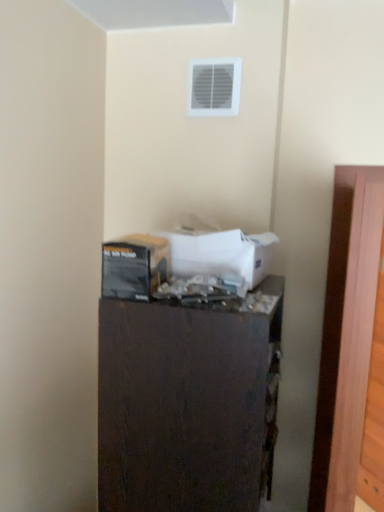
Find the location of a particular element. The height and width of the screenshot is (512, 384). white plastic vent at upper center is located at coordinates (213, 87).

At what (x,y) coordinates should I click in order to perform the action: click on wooden at right. Please return your answer as a coordinate pair (x, y). This screenshot has height=512, width=384. Looking at the image, I should click on (346, 335).

How much space does white cardboard box at center, which is counted as the first box, starting from the right, occupy vertically?

white cardboard box at center, which is counted as the first box, starting from the right, is 4.73 inches tall.

Measure the distance between dark wood dresser at center and camera.

A distance of 30.00 inches exists between dark wood dresser at center and camera.

The image size is (384, 512). I want to click on dark wood dresser at center, so click(188, 403).

Find the location of a particular element. This screenshot has height=512, width=384. white plastic vent at upper center is located at coordinates (213, 87).

Can white plastic vent at upper center be found inside dark wood dresser at center?

No, white plastic vent at upper center is not inside dark wood dresser at center.

Considering the positions of objects dark wood dresser at center and white plastic vent at upper center in the image provided, who is more to the left, dark wood dresser at center or white plastic vent at upper center?

Positioned to the left is dark wood dresser at center.

Identify the location of air conditioning behind the dark wood dresser at center. (213, 87).

Considering the relative sizes of dark wood dresser at center and white plastic vent at upper center in the image provided, is dark wood dresser at center bigger than white plastic vent at upper center?

Correct, dark wood dresser at center is larger in size than white plastic vent at upper center.

Does white cardboard box at center, the second box from the left, lie in front of wooden at right?

No, it is behind wooden at right.

Is white cardboard box at center, the second box from the left, with wooden at right?

No.

Who is shorter, white cardboard box at center, which is counted as the first box, starting from the right, or wooden at right?

white cardboard box at center, which is counted as the first box, starting from the right.

Looking at this image, from a real-world perspective, is white cardboard box at center, the second box from the left, above or below wooden at right?

In terms of real-world spatial position, white cardboard box at center, the second box from the left, is above wooden at right.

Considering the sizes of wooden at right and white plastic vent at upper center in the image, is wooden at right bigger or smaller than white plastic vent at upper center?

In the image, wooden at right appears to be larger than white plastic vent at upper center.

Is wooden at right directly adjacent to white plastic vent at upper center?

No, wooden at right is not making contact with white plastic vent at upper center.

Which is behind, point (364, 329) or point (232, 108)?

The point (232, 108) is behind.

In the scene shown: What's the angular difference between wooden at right and white plastic vent at upper center's facing directions?

There is a 87.6-degree angle between the facing directions of wooden at right and white plastic vent at upper center.

In order to click on air conditioning above the white cardboard box at center, which is counted as the first box, starting from the right (from a real-world perspective) in this screenshot , I will do `click(213, 87)`.

Is white plastic vent at upper center aimed at white cardboard box at center, the second box from the left?

No, white plastic vent at upper center is not facing towards white cardboard box at center, the second box from the left.

From the image's perspective, does white plastic vent at upper center appear higher than white cardboard box at center, the second box from the left?

Yes, from the image's perspective, white plastic vent at upper center is over white cardboard box at center, the second box from the left.

Considering the positions of objects white plastic vent at upper center and white cardboard box at center, which is counted as the first box, starting from the right, in the image provided, who is more to the left, white plastic vent at upper center or white cardboard box at center, which is counted as the first box, starting from the right,?

From the viewer's perspective, white plastic vent at upper center appears more on the left side.

From the image's perspective, is wooden at right located beneath matte black box at center, the 1th box positioned from the left?

Yes, from the image's perspective, wooden at right is beneath matte black box at center, the 1th box positioned from the left.

Looking at their sizes, would you say wooden at right is wider or thinner than matte black box at center, the 1th box positioned from the left?

Clearly, wooden at right has more width compared to matte black box at center, the 1th box positioned from the left.

Between wooden at right and matte black box at center, the 1th box positioned from the left, which one has more height?

With more height is wooden at right.

Would you say wooden at right is outside matte black box at center, which is the second box from right to left?

Yes, wooden at right is outside of matte black box at center, which is the second box from right to left.

From a real-world perspective, is matte black box at center, the 1th box positioned from the left, physically located above or below dark wood dresser at center?

Clearly, from a real-world perspective, matte black box at center, the 1th box positioned from the left, is above dark wood dresser at center.

How many degrees apart are the facing directions of matte black box at center, the 1th box positioned from the left, and dark wood dresser at center?

They differ by 3.56 degrees in their facing directions.

Is matte black box at center, which is the second box from right to left, far away from dark wood dresser at center?

No, matte black box at center, which is the second box from right to left, is not far from dark wood dresser at center.

Considering the relative sizes of matte black box at center, the 1th box positioned from the left, and dark wood dresser at center in the image provided, is matte black box at center, the 1th box positioned from the left, smaller than dark wood dresser at center?

Yes, matte black box at center, the 1th box positioned from the left, is smaller than dark wood dresser at center.

Does matte black box at center, which is the second box from right to left, lie in front of white plastic vent at upper center?

Yes, it is.

Between matte black box at center, the 1th box positioned from the left, and white plastic vent at upper center, which one has smaller size?

white plastic vent at upper center.

Can you tell me how much matte black box at center, which is the second box from right to left, and white plastic vent at upper center differ in facing direction?

There is a 94.5-degree angle between the facing directions of matte black box at center, which is the second box from right to left, and white plastic vent at upper center.

Does matte black box at center, which is the second box from right to left, turn towards white plastic vent at upper center?

No, matte black box at center, which is the second box from right to left, is not turned towards white plastic vent at upper center.

This screenshot has width=384, height=512. What are the coordinates of `furniture in front of the white plastic vent at upper center` in the screenshot? It's located at (188, 403).

This screenshot has height=512, width=384. Find the location of `the 2nd box above the wooden at right (from the image's perspective)`. the 2nd box above the wooden at right (from the image's perspective) is located at coordinates (219, 250).

When comparing their distances from white plastic vent at upper center, does white cardboard box at center, the second box from the left, or wooden at right seem closer?

Based on the image, white cardboard box at center, the second box from the left, appears to be nearer to white plastic vent at upper center.

Considering their positions, is dark wood dresser at center positioned further to matte black box at center, which is the second box from right to left, than white cardboard box at center, which is counted as the first box, starting from the right?

Among the two, dark wood dresser at center is located further to matte black box at center, which is the second box from right to left.

From the image, which object appears to be farther from wooden at right, white cardboard box at center, which is counted as the first box, starting from the right, or matte black box at center, which is the second box from right to left?

Based on the image, matte black box at center, which is the second box from right to left, appears to be further to wooden at right.

When comparing their distances from white plastic vent at upper center, does wooden at right or dark wood dresser at center seem closer?

wooden at right is positioned closer to the anchor white plastic vent at upper center.

Looking at this image, when comparing their distances from wooden at right, does dark wood dresser at center or matte black box at center, the 1th box positioned from the left, seem closer?

dark wood dresser at center is closer to wooden at right.

Based on their spatial positions, is matte black box at center, which is the second box from right to left, or dark wood dresser at center closer to white cardboard box at center, which is counted as the first box, starting from the right?

matte black box at center, which is the second box from right to left.

Considering their positions, is white plastic vent at upper center positioned further to white cardboard box at center, the second box from the left, than dark wood dresser at center?

white plastic vent at upper center is positioned further to the anchor white cardboard box at center, the second box from the left.

From the image, which object appears to be farther from dark wood dresser at center, wooden at right or white plastic vent at upper center?

white plastic vent at upper center.

Where is `door between matte black box at center, the 1th box positioned from the left, and dark wood dresser at center vertically`? The width and height of the screenshot is (384, 512). door between matte black box at center, the 1th box positioned from the left, and dark wood dresser at center vertically is located at coordinates (346, 335).

Identify the location of box between white cardboard box at center, which is counted as the first box, starting from the right, and dark wood dresser at center, in the vertical direction. Image resolution: width=384 pixels, height=512 pixels. (148, 254).

This screenshot has height=512, width=384. Find the location of `box between matte black box at center, the 1th box positioned from the left, and wooden at right, in the horizontal direction`. box between matte black box at center, the 1th box positioned from the left, and wooden at right, in the horizontal direction is located at coordinates (219, 250).

The height and width of the screenshot is (512, 384). I want to click on door between white plastic vent at upper center and dark wood dresser at center in the vertical direction, so click(346, 335).